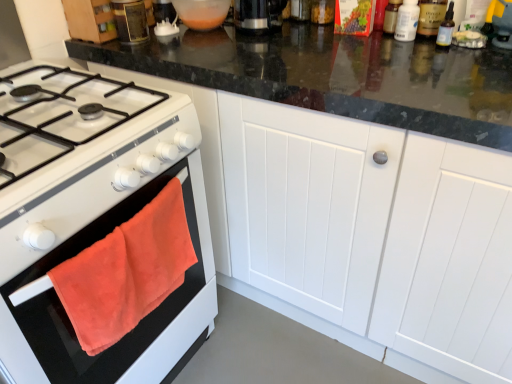
Question: From a real-world perspective, does white matte cabinet at center sit lower than black plastic coffee machine at upper center?

Choices:
 (A) no
 (B) yes

Answer: (B)

Question: From a real-world perspective, is white matte cabinet at center located higher than black plastic coffee machine at upper center?

Choices:
 (A) yes
 (B) no

Answer: (B)

Question: Does white matte cabinet at center have a smaller size compared to black plastic coffee machine at upper center?

Choices:
 (A) no
 (B) yes

Answer: (A)

Question: Is white matte cabinet at center further to the viewer compared to black plastic coffee machine at upper center?

Choices:
 (A) yes
 (B) no

Answer: (B)

Question: Is white matte cabinet at center beside black plastic coffee machine at upper center?

Choices:
 (A) no
 (B) yes

Answer: (A)

Question: From the image's perspective, is white matte cabinet at center under black plastic coffee machine at upper center?

Choices:
 (A) no
 (B) yes

Answer: (B)

Question: Considering the relative sizes of white matte cabinet at center and metallic canister at upper left in the image provided, is white matte cabinet at center taller than metallic canister at upper left?

Choices:
 (A) yes
 (B) no

Answer: (A)

Question: Are white matte cabinet at center and metallic canister at upper left located far from each other?

Choices:
 (A) yes
 (B) no

Answer: (B)

Question: Considering the relative sizes of white matte cabinet at center and metallic canister at upper left in the image provided, is white matte cabinet at center shorter than metallic canister at upper left?

Choices:
 (A) no
 (B) yes

Answer: (A)

Question: Is white matte cabinet at center facing away from metallic canister at upper left?

Choices:
 (A) no
 (B) yes

Answer: (A)

Question: Is white matte cabinet at center next to metallic canister at upper left?

Choices:
 (A) no
 (B) yes

Answer: (A)

Question: Is white matte cabinet at center bigger than metallic canister at upper left?

Choices:
 (A) no
 (B) yes

Answer: (B)

Question: Is metallic canister at upper left facing away from transparent plastic bottle at upper right, positioned as the first bottle in left-to-right order?

Choices:
 (A) no
 (B) yes

Answer: (A)